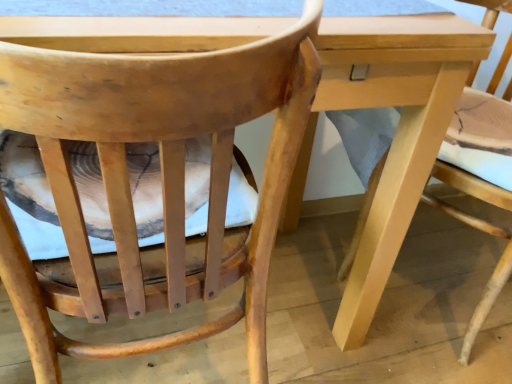
Question: In terms of height, does natural wood chair at center, positioned as the 2th chair in left-to-right order, look taller or shorter compared to wooden chair at center, which is counted as the first chair, starting from the left?

Choices:
 (A) tall
 (B) short

Answer: (B)

Question: Considering the positions of natural wood chair at center, positioned as the 2th chair in left-to-right order, and wooden chair at center, which is counted as the first chair, starting from the left, in the image, is natural wood chair at center, positioned as the 2th chair in left-to-right order, bigger or smaller than wooden chair at center, which is counted as the first chair, starting from the left,?

Choices:
 (A) big
 (B) small

Answer: (A)

Question: From the image's perspective, is natural wood chair at center, placed as the 1th chair when sorted from right to left, positioned above or below wooden chair at center, which ranks as the 2th chair in right-to-left order?

Choices:
 (A) below
 (B) above

Answer: (B)

Question: Relative to natural wood chair at center, placed as the 1th chair when sorted from right to left, is wooden chair at center, which is counted as the first chair, starting from the left, in front or behind?

Choices:
 (A) front
 (B) behind

Answer: (A)

Question: Considering the positions of wooden chair at center, which ranks as the 2th chair in right-to-left order, and natural wood chair at center, positioned as the 2th chair in left-to-right order, in the image, is wooden chair at center, which ranks as the 2th chair in right-to-left order, taller or shorter than natural wood chair at center, positioned as the 2th chair in left-to-right order,?

Choices:
 (A) tall
 (B) short

Answer: (A)

Question: In terms of size, does wooden chair at center, which is counted as the first chair, starting from the left, appear bigger or smaller than natural wood chair at center, placed as the 1th chair when sorted from right to left?

Choices:
 (A) big
 (B) small

Answer: (B)

Question: From a real-world perspective, relative to natural wood chair at center, placed as the 1th chair when sorted from right to left, is wooden chair at center, which ranks as the 2th chair in right-to-left order, vertically above or below?

Choices:
 (A) above
 (B) below

Answer: (A)